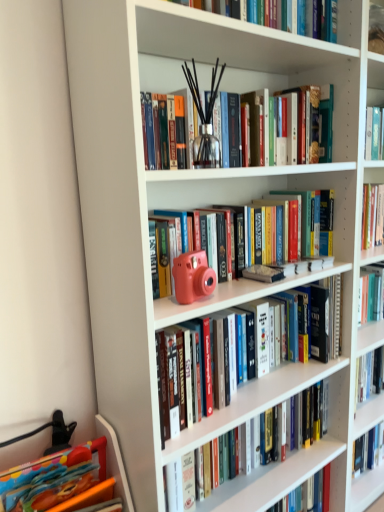
Measure the distance between point (x=220, y=313) and camera.

1.05 meters.

How much space does matte pink camera at center, marked as the fourth book in a top-to-bottom arrangement, occupy horizontally?

It is 9.74 inches.

Where is `hardcover book at upper center, arranged as the 1th book when viewed from the top`? The image size is (384, 512). hardcover book at upper center, arranged as the 1th book when viewed from the top is located at coordinates (x=277, y=14).

Where is `clear glass vase at upper center, which is the 5th book in bottom-to-top order`? The height and width of the screenshot is (512, 384). clear glass vase at upper center, which is the 5th book in bottom-to-top order is located at coordinates (305, 116).

The height and width of the screenshot is (512, 384). What do you see at coordinates (57, 480) in the screenshot?
I see `multicolored plastic toy at lower left, which is the 6th book in top-to-bottom order` at bounding box center [57, 480].

Locate an element on the screen. The image size is (384, 512). matte pink camera at center, marked as the fourth book in a top-to-bottom arrangement is located at coordinates (226, 298).

Which object is more forward, matte pink camera at center, positioned as the third book in bottom-to-top order, or matte pink camera at center, positioned as the 3th book in top-to-bottom order?

Positioned in front is matte pink camera at center, positioned as the 3th book in top-to-bottom order.

From a real-world perspective, who is located lower, matte pink camera at center, positioned as the third book in bottom-to-top order, or matte pink camera at center, which is counted as the fourth book, starting from the bottom?

From a 3D spatial view, matte pink camera at center, positioned as the third book in bottom-to-top order, is below.

Is point (266, 364) positioned after point (270, 262)?

Yes, point (266, 364) is behind point (270, 262).

From the image's perspective, starting from the matte pink camera at center, positioned as the third book in bottom-to-top order, which book is the 1st one above? Please provide its 2D coordinates.

[(276, 234)]

From the image's perspective, which one is positioned higher, hardcover book at upper center, the sixth book from the bottom, or hardcover book at center, which is counted as the 5th book, starting from the top?

hardcover book at upper center, the sixth book from the bottom.

Can you confirm if hardcover book at upper center, the sixth book from the bottom, is shorter than hardcover book at center, which is counted as the second book, starting from the bottom?

Yes, hardcover book at upper center, the sixth book from the bottom, is shorter than hardcover book at center, which is counted as the second book, starting from the bottom.

Is there a large distance between hardcover book at upper center, the sixth book from the bottom, and hardcover book at center, which is counted as the 5th book, starting from the top?

hardcover book at upper center, the sixth book from the bottom, is far away from hardcover book at center, which is counted as the 5th book, starting from the top.

Between point (299, 22) and point (262, 467), which one is positioned in front?

Point (299, 22)

Is hardcover book at upper center, the sixth book from the bottom, at the back of matte pink camera at center, marked as the fourth book in a top-to-bottom arrangement?

No.

Is matte pink camera at center, marked as the fourth book in a top-to-bottom arrangement, wider or thinner than hardcover book at upper center, arranged as the 1th book when viewed from the top?

Clearly, matte pink camera at center, marked as the fourth book in a top-to-bottom arrangement, has more width compared to hardcover book at upper center, arranged as the 1th book when viewed from the top.

From a real-world perspective, is matte pink camera at center, positioned as the third book in bottom-to-top order, positioned under hardcover book at upper center, arranged as the 1th book when viewed from the top, based on gravity?

Yes, from a real-world perspective, matte pink camera at center, positioned as the third book in bottom-to-top order, is beneath hardcover book at upper center, arranged as the 1th book when viewed from the top.

Considering the positions of objects matte pink camera at center, marked as the fourth book in a top-to-bottom arrangement, and hardcover book at upper center, the sixth book from the bottom, in the image provided, who is in front, matte pink camera at center, marked as the fourth book in a top-to-bottom arrangement, or hardcover book at upper center, the sixth book from the bottom,?

hardcover book at upper center, the sixth book from the bottom, is more forward.

Considering the positions of points (277, 197) and (243, 281), is point (277, 197) closer to camera compared to point (243, 281)?

No, (277, 197) is behind (243, 281).

Between matte pink camera at center, which is counted as the fourth book, starting from the bottom, and matte pink camera at center, positioned as the third book in bottom-to-top order, which one has less height?

matte pink camera at center, which is counted as the fourth book, starting from the bottom, is shorter.

Considering the positions of objects matte pink camera at center, positioned as the 3th book in top-to-bottom order, and matte pink camera at center, marked as the fourth book in a top-to-bottom arrangement, in the image provided, who is more to the right, matte pink camera at center, positioned as the 3th book in top-to-bottom order, or matte pink camera at center, marked as the fourth book in a top-to-bottom arrangement,?

Positioned to the right is matte pink camera at center, marked as the fourth book in a top-to-bottom arrangement.

Does matte pink camera at center, which is counted as the fourth book, starting from the bottom, turn towards matte pink camera at center, marked as the fourth book in a top-to-bottom arrangement?

No, matte pink camera at center, which is counted as the fourth book, starting from the bottom, does not turn towards matte pink camera at center, marked as the fourth book in a top-to-bottom arrangement.

Could multicolored plastic toy at lower left, positioned as the first book in bottom-to-top order, be considered to be inside matte pink camera at center, positioned as the third book in bottom-to-top order?

No, multicolored plastic toy at lower left, positioned as the first book in bottom-to-top order, is located outside of matte pink camera at center, positioned as the third book in bottom-to-top order.

Is matte pink camera at center, positioned as the third book in bottom-to-top order, positioned with its back to multicolored plastic toy at lower left, positioned as the first book in bottom-to-top order?

No, matte pink camera at center, positioned as the third book in bottom-to-top order, is not facing away from multicolored plastic toy at lower left, positioned as the first book in bottom-to-top order.

Which book is the 4th one when counting from the back of the multicolored plastic toy at lower left, positioned as the first book in bottom-to-top order? Please provide its 2D coordinates.

[(226, 298)]

Is matte pink camera at center, positioned as the third book in bottom-to-top order, in front of or behind multicolored plastic toy at lower left, positioned as the first book in bottom-to-top order, in the image?

matte pink camera at center, positioned as the third book in bottom-to-top order, is behind multicolored plastic toy at lower left, positioned as the first book in bottom-to-top order.

Is hardcover book at center, which is counted as the 5th book, starting from the top, far away from multicolored plastic toy at lower left, which is the 6th book in top-to-bottom order?

No, there isn't a large distance between hardcover book at center, which is counted as the 5th book, starting from the top, and multicolored plastic toy at lower left, which is the 6th book in top-to-bottom order.

In the image, is hardcover book at center, which is counted as the second book, starting from the bottom, positioned in front of or behind multicolored plastic toy at lower left, positioned as the first book in bottom-to-top order?

hardcover book at center, which is counted as the second book, starting from the bottom, is positioned farther from the viewer than multicolored plastic toy at lower left, positioned as the first book in bottom-to-top order.

Consider the image. Between hardcover book at center, which is counted as the second book, starting from the bottom, and multicolored plastic toy at lower left, positioned as the first book in bottom-to-top order, which one has less height?

With less height is multicolored plastic toy at lower left, positioned as the first book in bottom-to-top order.

Image resolution: width=384 pixels, height=512 pixels. What are the coordinates of `book that is below the hardcover book at center, which is counted as the second book, starting from the bottom (from the image's perspective)` in the screenshot? It's located at (57, 480).

The height and width of the screenshot is (512, 384). I want to click on the 1st book positioned below the clear glass vase at upper center, which appears as the second book when viewed from the top (from the image's perspective), so click(276, 234).

Looking at this image, which is more to the left, clear glass vase at upper center, which appears as the second book when viewed from the top, or matte pink camera at center, positioned as the 3th book in top-to-bottom order?

clear glass vase at upper center, which appears as the second book when viewed from the top.

Is clear glass vase at upper center, which is the 5th book in bottom-to-top order, directly adjacent to matte pink camera at center, which is counted as the fourth book, starting from the bottom?

No, clear glass vase at upper center, which is the 5th book in bottom-to-top order, is not touching matte pink camera at center, which is counted as the fourth book, starting from the bottom.

Identify the location of the 1st book positioned above the matte pink camera at center, marked as the fourth book in a top-to-bottom arrangement (from the image's perspective). This screenshot has height=512, width=384. click(276, 234).

Identify the location of book that is the 2nd object to the left of the hardcover book at center, which is counted as the 5th book, starting from the top, starting at the anchor. (277, 14).

Considering their positions, is matte pink camera at center, positioned as the third book in bottom-to-top order, positioned further to clear glass vase at upper center, which appears as the second book when viewed from the top, than multicolored plastic toy at lower left, which is the 6th book in top-to-bottom order?

Among the two, multicolored plastic toy at lower left, which is the 6th book in top-to-bottom order, is located further to clear glass vase at upper center, which appears as the second book when viewed from the top.

When comparing their distances from matte pink camera at center, positioned as the third book in bottom-to-top order, does clear glass vase at upper center, which is the 5th book in bottom-to-top order, or hardcover book at center, which is counted as the 5th book, starting from the top, seem closer?

Based on the image, clear glass vase at upper center, which is the 5th book in bottom-to-top order, appears to be nearer to matte pink camera at center, positioned as the third book in bottom-to-top order.

Which object lies further to the anchor point hardcover book at upper center, arranged as the 1th book when viewed from the top, matte pink camera at center, positioned as the 3th book in top-to-bottom order, or multicolored plastic toy at lower left, positioned as the first book in bottom-to-top order?

Based on the image, multicolored plastic toy at lower left, positioned as the first book in bottom-to-top order, appears to be further to hardcover book at upper center, arranged as the 1th book when viewed from the top.

Considering their positions, is clear glass vase at upper center, which appears as the second book when viewed from the top, positioned further to hardcover book at center, which is counted as the second book, starting from the bottom, than matte pink camera at center, marked as the fourth book in a top-to-bottom arrangement?

Among the two, clear glass vase at upper center, which appears as the second book when viewed from the top, is located further to hardcover book at center, which is counted as the second book, starting from the bottom.

Which object lies further to the anchor point matte pink camera at center, which is counted as the fourth book, starting from the bottom, hardcover book at center, which is counted as the second book, starting from the bottom, or hardcover book at upper center, arranged as the 1th book when viewed from the top?

hardcover book at center, which is counted as the second book, starting from the bottom, lies further to matte pink camera at center, which is counted as the fourth book, starting from the bottom, than the other object.

From the image, which object appears to be farther from matte pink camera at center, marked as the fourth book in a top-to-bottom arrangement, clear glass vase at upper center, which is the 5th book in bottom-to-top order, or multicolored plastic toy at lower left, positioned as the first book in bottom-to-top order?

The object further to matte pink camera at center, marked as the fourth book in a top-to-bottom arrangement, is clear glass vase at upper center, which is the 5th book in bottom-to-top order.

Based on their spatial positions, is clear glass vase at upper center, which appears as the second book when viewed from the top, or hardcover book at center, which is counted as the second book, starting from the bottom, further from hardcover book at upper center, the sixth book from the bottom?

hardcover book at center, which is counted as the second book, starting from the bottom, lies further to hardcover book at upper center, the sixth book from the bottom, than the other object.

Which object lies further to the anchor point hardcover book at center, which is counted as the second book, starting from the bottom, multicolored plastic toy at lower left, positioned as the first book in bottom-to-top order, or hardcover book at upper center, the sixth book from the bottom?

Among the two, hardcover book at upper center, the sixth book from the bottom, is located further to hardcover book at center, which is counted as the second book, starting from the bottom.

I want to click on book between matte pink camera at center, which is counted as the fourth book, starting from the bottom, and hardcover book at center, which is counted as the second book, starting from the bottom, in the up-down direction, so click(226, 298).

This screenshot has width=384, height=512. Find the location of `book that lies between hardcover book at upper center, the sixth book from the bottom, and matte pink camera at center, which is counted as the fourth book, starting from the bottom, from top to bottom`. book that lies between hardcover book at upper center, the sixth book from the bottom, and matte pink camera at center, which is counted as the fourth book, starting from the bottom, from top to bottom is located at coordinates (305, 116).

Locate an element on the screen. The image size is (384, 512). book between clear glass vase at upper center, which appears as the second book when viewed from the top, and matte pink camera at center, marked as the fourth book in a top-to-bottom arrangement, vertically is located at coordinates (276, 234).